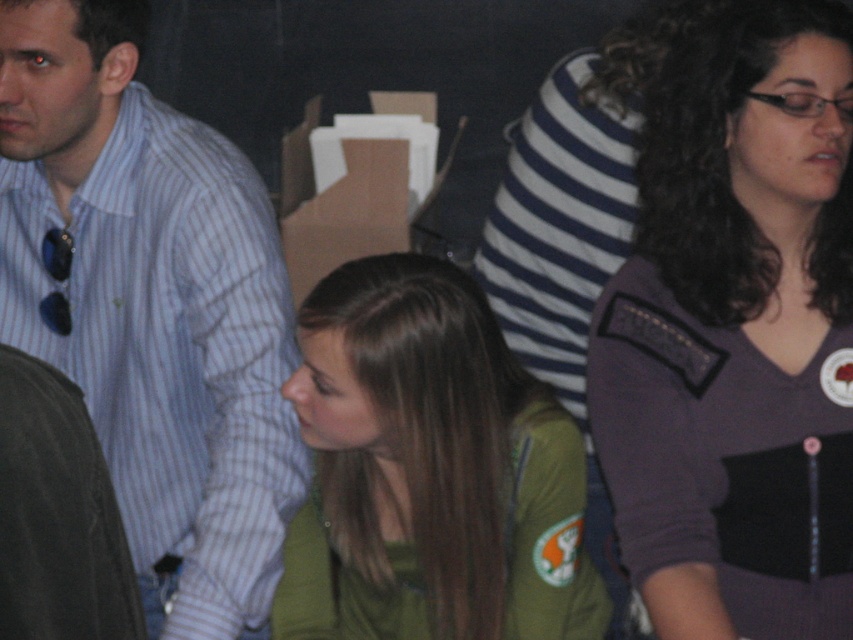
Does purple fabric shirt at center have a lesser width compared to green matte jacket at center?

Indeed, purple fabric shirt at center has a lesser width compared to green matte jacket at center.

Can you confirm if purple fabric shirt at center is shorter than green matte jacket at center?

In fact, purple fabric shirt at center may be taller than green matte jacket at center.

What do you see at coordinates (737, 332) in the screenshot?
I see `purple fabric shirt at center` at bounding box center [737, 332].

Locate an element on the screen. The width and height of the screenshot is (853, 640). purple fabric shirt at center is located at coordinates (737, 332).

Who is taller, purple fabric shirt at center or cardboard box at center?

With more height is purple fabric shirt at center.

Who is lower down, purple fabric shirt at center or cardboard box at center?

Positioned lower is purple fabric shirt at center.

Who is more distant from viewer, [715,35] or [425,141]?

The point [425,141] is more distant.

At what (x,y) coordinates should I click in order to perform the action: click on purple fabric shirt at center. Please return your answer as a coordinate pair (x, y). Looking at the image, I should click on (737, 332).

Does blue striped shirt at left have a greater width compared to cardboard box at center?

Yes, blue striped shirt at left is wider than cardboard box at center.

Does blue striped shirt at left appear on the left side of cardboard box at center?

Correct, you'll find blue striped shirt at left to the left of cardboard box at center.

Image resolution: width=853 pixels, height=640 pixels. Find the location of `blue striped shirt at left`. blue striped shirt at left is located at coordinates (151, 307).

The width and height of the screenshot is (853, 640). Identify the location of blue striped shirt at left. (151, 307).